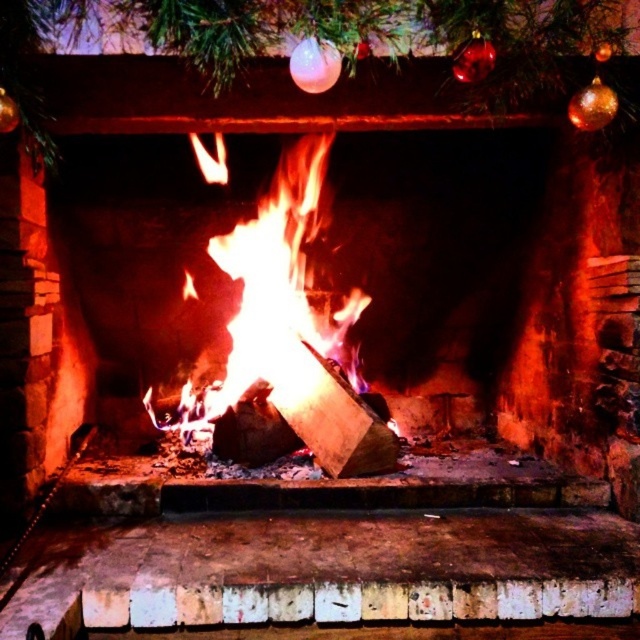
Does brick fireplace at center have a larger size compared to shiny glass ornaments at upper center?

Correct, brick fireplace at center is larger in size than shiny glass ornaments at upper center.

Consider the image. Does brick fireplace at center have a greater width compared to shiny glass ornaments at upper center?

Yes.

Is point (509, 221) positioned behind point (166, 13)?

Yes, point (509, 221) is behind point (166, 13).

Locate an element on the screen. brick fireplace at center is located at coordinates (316, 244).

Does point (58, 262) lie behind point (259, 348)?

No, (58, 262) is in front of (259, 348).

Which is more to the left, brick fireplace at center or flaming wood at center?

brick fireplace at center

Identify the location of brick fireplace at center. (316, 244).

Where is `shiny glass ornaments at upper center`? The width and height of the screenshot is (640, 640). shiny glass ornaments at upper center is located at coordinates (316, 36).

Measure the distance between point (470, 8) and camera.

The distance of point (470, 8) from camera is 9.61 feet.

Is point (524, 19) farther from camera compared to point (275, 266)?

That is False.

Where is `shiny glass ornaments at upper center`? The width and height of the screenshot is (640, 640). shiny glass ornaments at upper center is located at coordinates (316, 36).